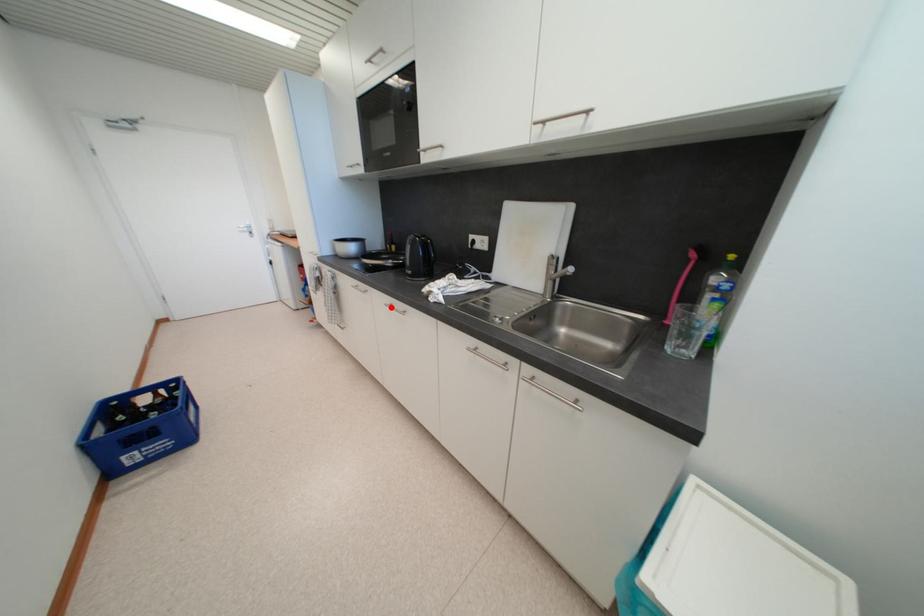
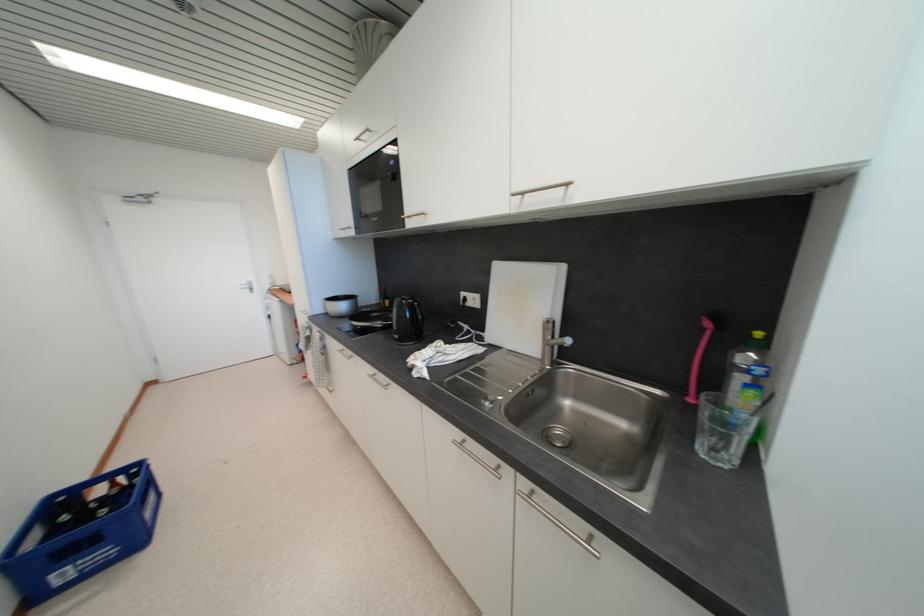
Question: I am providing you with two images of the same scene from different viewpoints. A red point is marked on the first image. At the location where the point appears in image 1, is it still visible in image 2?

Choices:
 (A) Yes
 (B) No

Answer: (A)